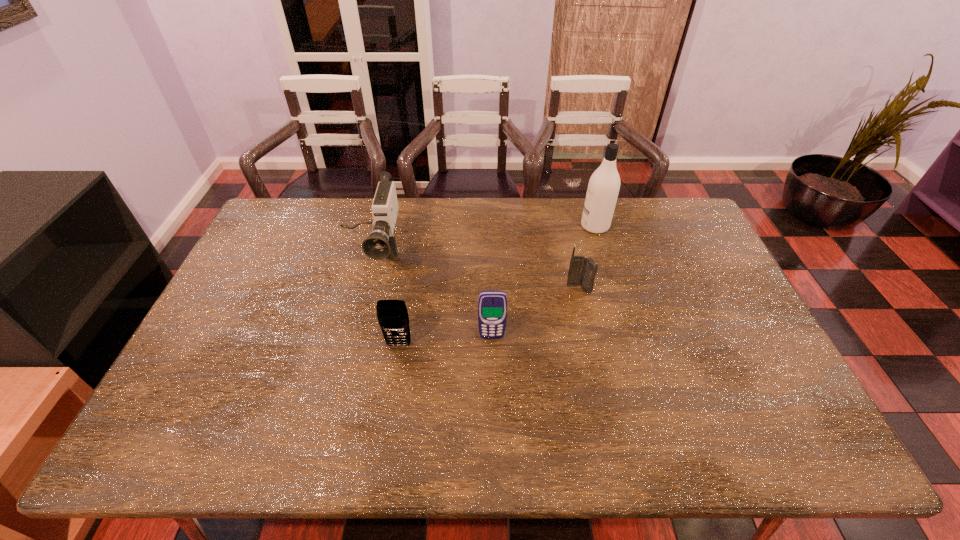
Image resolution: width=960 pixels, height=540 pixels. Find the location of `vacant space positioned on the front-facing side of the shampoo`. vacant space positioned on the front-facing side of the shampoo is located at coordinates (521, 226).

You are a GUI agent. You are given a task and a screenshot of the screen. Output one action in this format:
    pyautogui.click(x=<x>, y=<y>)
    Task: Click on the vacant space located 0.340m on the front-facing side of the shampoo
    
    Given the screenshot: What is the action you would take?
    pyautogui.click(x=485, y=226)

Find the location of a particular element. free location located 0.400m on the recording direction of the fourth shortest object is located at coordinates coord(332,405).

The height and width of the screenshot is (540, 960). What are the coordinates of `vacant space situated on the front-facing side of the fourth farthest object` in the screenshot? It's located at (492, 364).

This screenshot has width=960, height=540. What are the coordinates of `free space located on the screen of the nearest cellular telephone` in the screenshot? It's located at (381, 457).

This screenshot has width=960, height=540. In order to click on vacant space situated on the keyboard of the fourth object from left to right in this screenshot , I will do `click(585, 315)`.

Find the location of a particular element. This screenshot has height=540, width=960. shampoo present at the far edge is located at coordinates (603, 188).

At what (x,y) coordinates should I click in order to perform the action: click on camcorder that is at the far edge. Please return your answer as a coordinate pair (x, y). Looking at the image, I should click on (381, 243).

This screenshot has width=960, height=540. In the image, there is a desktop. Identify the location of free region at the far edge. coord(636,206).

The height and width of the screenshot is (540, 960). In order to click on vacant region at the near edge of the desktop in this screenshot , I will do `click(539, 424)`.